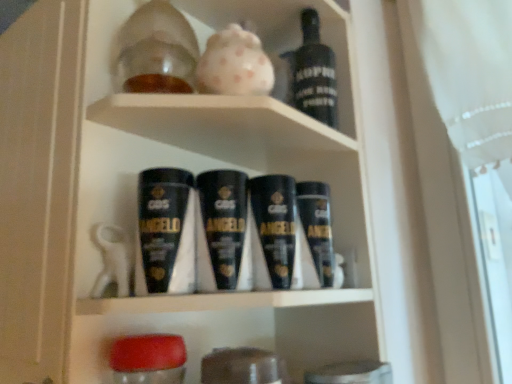
Question: Is translucent glass jar at upper center bigger than black matte bottle at upper center?

Choices:
 (A) no
 (B) yes

Answer: (B)

Question: Does translucent glass jar at upper center have a smaller size compared to black matte bottle at upper center?

Choices:
 (A) yes
 (B) no

Answer: (B)

Question: Is translucent glass jar at upper center placed right next to black matte bottle at upper center?

Choices:
 (A) yes
 (B) no

Answer: (A)

Question: Can you confirm if translucent glass jar at upper center is shorter than black matte bottle at upper center?

Choices:
 (A) no
 (B) yes

Answer: (B)

Question: Can we say translucent glass jar at upper center lies outside black matte bottle at upper center?

Choices:
 (A) yes
 (B) no

Answer: (A)

Question: From a real-world perspective, is black matte shaving cream at center physically located above or below black matte bottle at upper center?

Choices:
 (A) below
 (B) above

Answer: (A)

Question: In the image, is black matte shaving cream at center positioned in front of or behind black matte bottle at upper center?

Choices:
 (A) front
 (B) behind

Answer: (A)

Question: Does point (145, 284) appear closer or farther from the camera than point (322, 56)?

Choices:
 (A) farther
 (B) closer

Answer: (B)

Question: Looking at their shapes, would you say black matte shaving cream at center is wider or thinner than black matte bottle at upper center?

Choices:
 (A) wide
 (B) thin

Answer: (A)

Question: From the image's perspective, relative to translucent glass jar at upper center, is black matte bottle at upper center above or below?

Choices:
 (A) below
 (B) above

Answer: (A)

Question: Is point (304, 39) closer or farther from the camera than point (352, 92)?

Choices:
 (A) farther
 (B) closer

Answer: (A)

Question: Is black matte bottle at upper center to the left or to the right of translucent glass jar at upper center in the image?

Choices:
 (A) left
 (B) right

Answer: (B)

Question: Looking at the image, does black matte bottle at upper center seem bigger or smaller compared to translucent glass jar at upper center?

Choices:
 (A) big
 (B) small

Answer: (B)

Question: Visually, is translucent glass jar at upper center positioned to the left or to the right of black matte bottle at upper center?

Choices:
 (A) right
 (B) left

Answer: (B)

Question: Is translucent glass jar at upper center bigger or smaller than black matte bottle at upper center?

Choices:
 (A) small
 (B) big

Answer: (B)